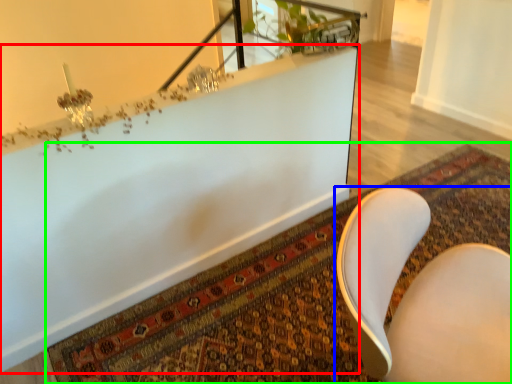
Question: Estimate the real-world distances between objects in this image. Which object is farther from bathtub (highlighted by a red box), chair (highlighted by a blue box) or mat (highlighted by a green box)?

Choices:
 (A) chair
 (B) mat

Answer: (A)